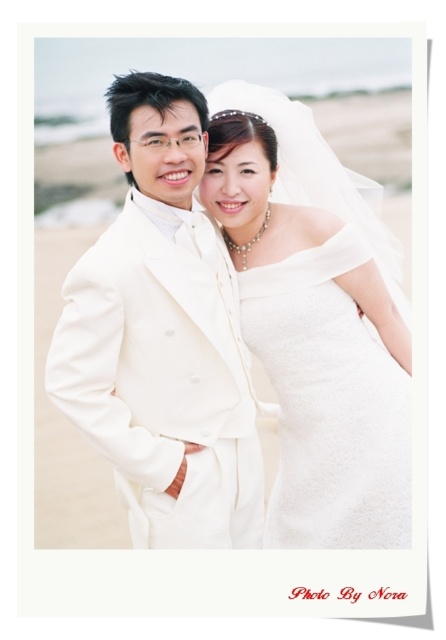
Who is positioned more to the right, matte white suit at center or satin white dress at center?

From the viewer's perspective, satin white dress at center appears more on the right side.

You are a GUI agent. You are given a task and a screenshot of the screen. Output one action in this format:
    pyautogui.click(x=<x>, y=<y>)
    Task: Click on the matte white suit at center
    
    Given the screenshot: What is the action you would take?
    pyautogui.click(x=162, y=337)